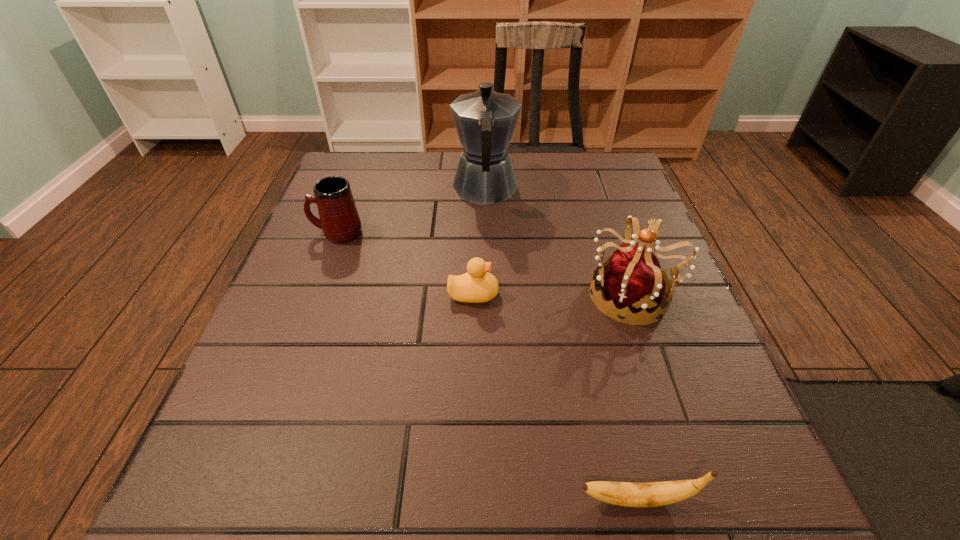
What are the coordinates of `the tallest object` in the screenshot? It's located at (485, 120).

Where is `the farthest object`? This screenshot has width=960, height=540. the farthest object is located at coordinates (485, 120).

Where is `the fourth shortest object`? This screenshot has height=540, width=960. the fourth shortest object is located at coordinates click(633, 280).

At what (x,y) coordinates should I click in order to perform the action: click on mug. Please return your answer as a coordinate pair (x, y). This screenshot has width=960, height=540. Looking at the image, I should click on (340, 222).

You are a GUI agent. You are given a task and a screenshot of the screen. Output one action in this format:
    pyautogui.click(x=<x>, y=<y>)
    Task: Click on the third shortest object
    The width and height of the screenshot is (960, 540).
    Given the screenshot: What is the action you would take?
    pyautogui.click(x=340, y=222)

The width and height of the screenshot is (960, 540). In order to click on duck in this screenshot , I will do `click(477, 285)`.

This screenshot has height=540, width=960. Identify the location of banana. (651, 494).

Image resolution: width=960 pixels, height=540 pixels. I want to click on vacant position located at the spout of the tallest object, so click(485, 154).

I want to click on blank area located 0.080m at the spout of the tallest object, so point(485,151).

Identify the location of vacant space located on the front-facing side of the tiara. (420, 295).